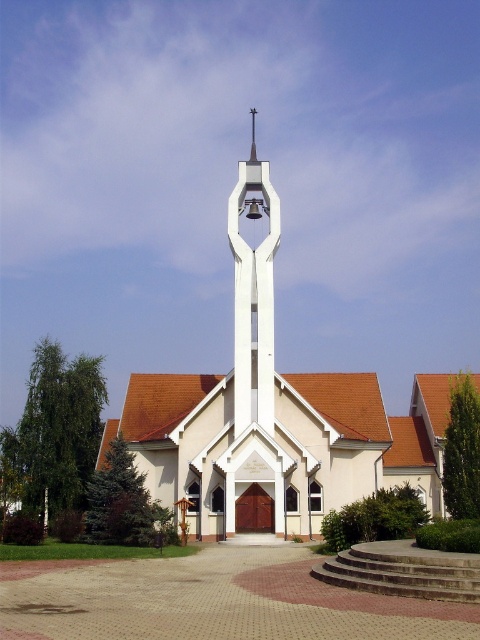
You are standing in front of the modern church and want to locate both the white smooth church steeple at center and the white smooth bell at center. Which one is positioned higher up in the image?

The white smooth bell at center is positioned higher up because the white smooth church steeple at center is located below it.